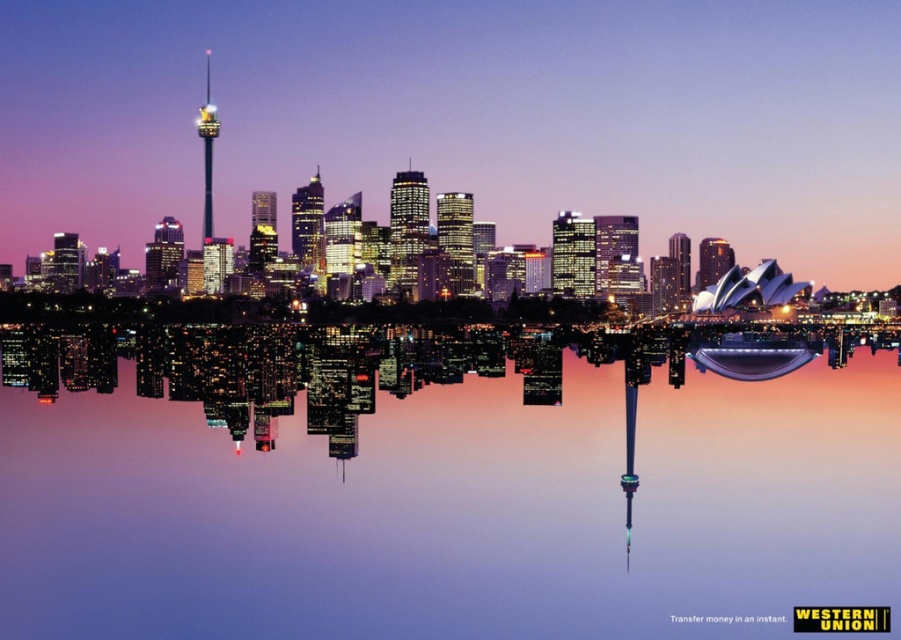
Question: Can you confirm if transparent glass water at center is bigger than shiny glass tower at center?

Choices:
 (A) yes
 (B) no

Answer: (B)

Question: Can you confirm if transparent glass water at center is positioned to the left of shiny glass tower at center?

Choices:
 (A) yes
 (B) no

Answer: (B)

Question: Which point is closer to the camera?

Choices:
 (A) (587, 81)
 (B) (151, 417)

Answer: (A)

Question: Which object appears farthest from the camera in this image?

Choices:
 (A) shiny glass tower at center
 (B) transparent glass water at center

Answer: (A)

Question: Does transparent glass water at center appear on the left side of shiny glass tower at center?

Choices:
 (A) no
 (B) yes

Answer: (A)

Question: Which object is closer to the camera taking this photo?

Choices:
 (A) transparent glass water at center
 (B) shiny glass tower at center

Answer: (A)